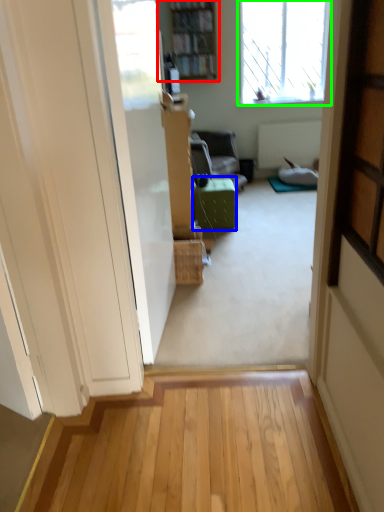
Question: Which is farther away from bookcase (highlighted by a red box)? furniture (highlighted by a blue box) or window (highlighted by a green box)?

Choices:
 (A) furniture
 (B) window

Answer: (A)